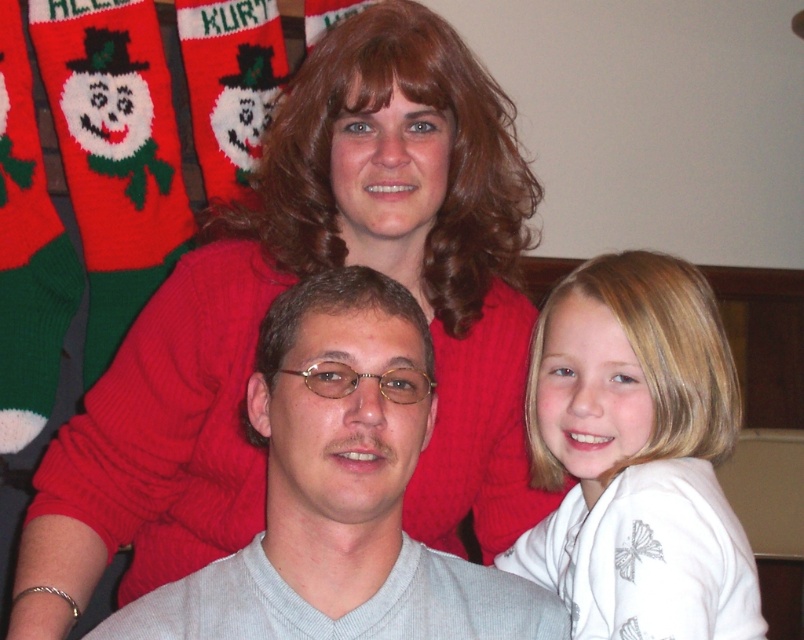
Question: Is gray knit sweater at center above white satin shirt at right?

Choices:
 (A) yes
 (B) no

Answer: (B)

Question: Which point is farther to the camera?

Choices:
 (A) gray knit sweater at center
 (B) white satin shirt at right

Answer: (B)

Question: Which object is farther from the camera taking this photo?

Choices:
 (A) white satin shirt at right
 (B) gray knit sweater at center

Answer: (A)

Question: Is gray knit sweater at center smaller than white satin shirt at right?

Choices:
 (A) no
 (B) yes

Answer: (B)

Question: Is the position of gray knit sweater at center more distant than that of white satin shirt at right?

Choices:
 (A) yes
 (B) no

Answer: (B)